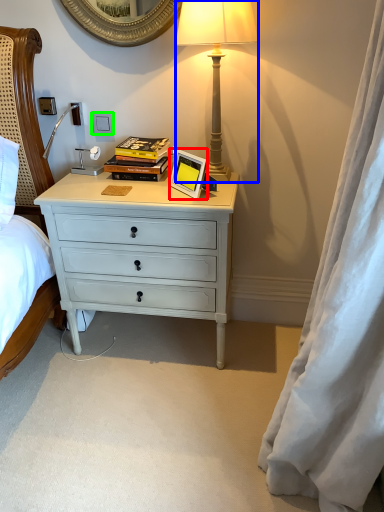
Question: Based on their relative distances, which object is farther from picture frame (highlighted by a red box)? Choose from lamp (highlighted by a blue box) and power outlet (highlighted by a green box).

Choices:
 (A) lamp
 (B) power outlet

Answer: (B)